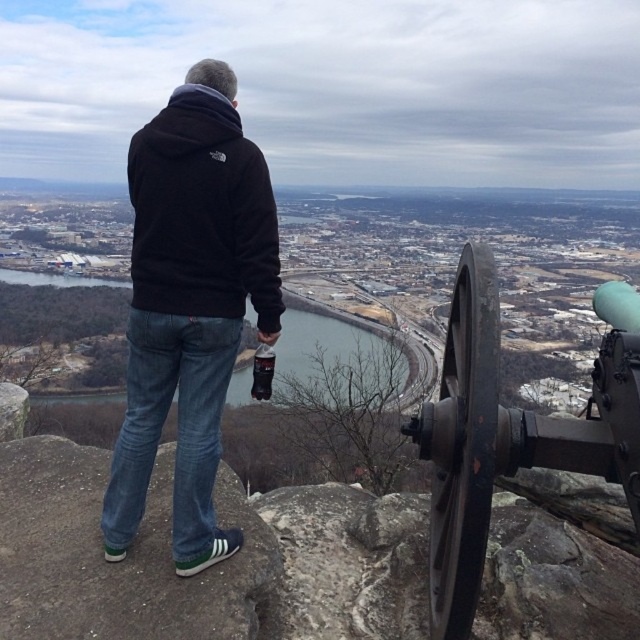
Can you confirm if black matte hoodie at center is positioned to the left of rusty metal cannon at right?

Correct, you'll find black matte hoodie at center to the left of rusty metal cannon at right.

Is point (148, 276) positioned after point (465, 497)?

Yes.

This screenshot has width=640, height=640. What are the coordinates of `black matte hoodie at center` in the screenshot? It's located at (189, 305).

Where is `black matte hoodie at center`? The image size is (640, 640). black matte hoodie at center is located at coordinates (189, 305).

Which is more to the left, blue jeans at center or black fleece hoodie at upper center?

black fleece hoodie at upper center is more to the left.

Looking at this image, is blue jeans at center smaller than black fleece hoodie at upper center?

Yes, blue jeans at center is smaller than black fleece hoodie at upper center.

The width and height of the screenshot is (640, 640). I want to click on blue jeans at center, so click(124, 561).

Does blue jeans at center appear under rusty metal cannon at right?

Yes, blue jeans at center is below rusty metal cannon at right.

Does blue jeans at center have a smaller size compared to rusty metal cannon at right?

Correct, blue jeans at center occupies less space than rusty metal cannon at right.

Locate an element on the screen. This screenshot has height=640, width=640. blue jeans at center is located at coordinates (124, 561).

The image size is (640, 640). I want to click on blue jeans at center, so click(x=124, y=561).